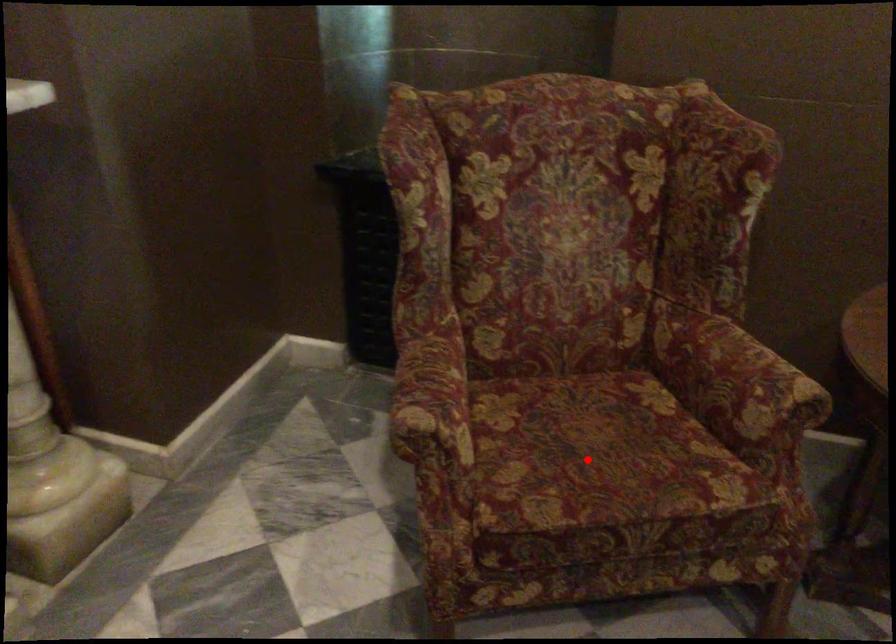
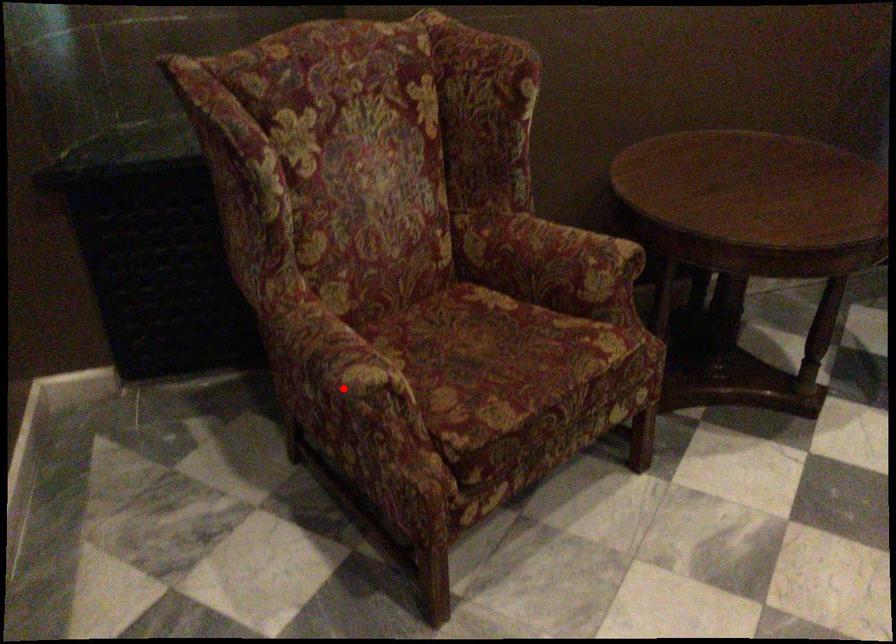
I am providing you with two images of the same scene from different viewpoints. A red point is marked on the first image and another point is marked on the second image. Do the highlighted points in image1 and image2 indicate the same real-world spot?

No